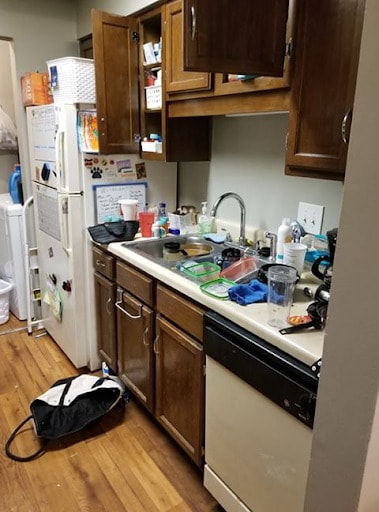
In order to click on cabinet door in this screenshot , I will do `click(115, 66)`.